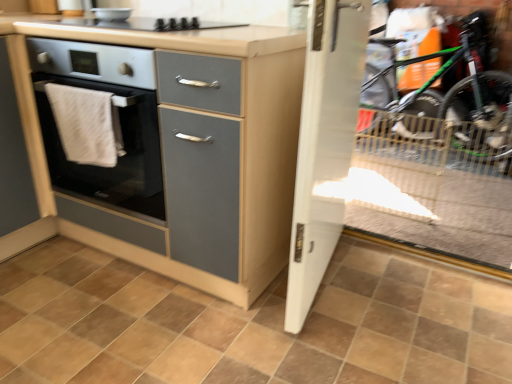
Identify the location of free spot below white glossy door at center (from a real-world perspective). (328, 288).